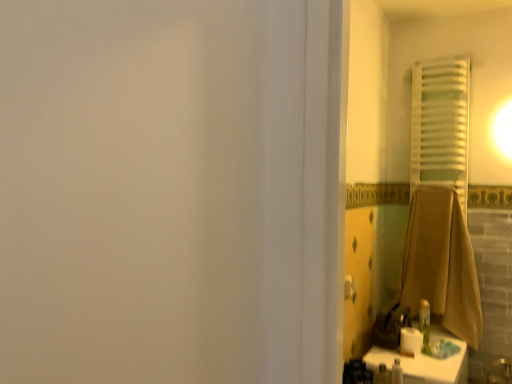
Question: From the image's perspective, is white matte toilet paper at lower right beneath brown cotton towel at right?

Choices:
 (A) no
 (B) yes

Answer: (B)

Question: From the image's perspective, is white matte toilet paper at lower right on brown cotton towel at right?

Choices:
 (A) yes
 (B) no

Answer: (B)

Question: Does white matte toilet paper at lower right have a lesser height compared to brown cotton towel at right?

Choices:
 (A) no
 (B) yes

Answer: (B)

Question: Does white matte toilet paper at lower right contain brown cotton towel at right?

Choices:
 (A) yes
 (B) no

Answer: (B)

Question: Is white matte toilet paper at lower right thinner than brown cotton towel at right?

Choices:
 (A) no
 (B) yes

Answer: (B)

Question: From a real-world perspective, relative to white glossy counter top at lower right, is brown cotton towel at right vertically above or below?

Choices:
 (A) above
 (B) below

Answer: (A)

Question: Do you think brown cotton towel at right is within white glossy counter top at lower right, or outside of it?

Choices:
 (A) inside
 (B) outside

Answer: (B)

Question: In terms of size, does brown cotton towel at right appear bigger or smaller than white glossy counter top at lower right?

Choices:
 (A) small
 (B) big

Answer: (A)

Question: From the image's perspective, is brown cotton towel at right above or below white glossy counter top at lower right?

Choices:
 (A) above
 (B) below

Answer: (A)

Question: In terms of size, does white fabric towel at right appear bigger or smaller than white matte toilet paper at lower right?

Choices:
 (A) big
 (B) small

Answer: (A)

Question: From a real-world perspective, is white fabric towel at right physically located above or below white matte toilet paper at lower right?

Choices:
 (A) above
 (B) below

Answer: (A)

Question: Would you say white fabric towel at right is inside or outside white matte toilet paper at lower right?

Choices:
 (A) outside
 (B) inside

Answer: (A)

Question: Is point (420, 107) closer or farther from the camera than point (411, 332)?

Choices:
 (A) farther
 (B) closer

Answer: (A)

Question: Is white fabric towel at right taller or shorter than brown cotton towel at right?

Choices:
 (A) short
 (B) tall

Answer: (B)

Question: Is white fabric towel at right to the left or to the right of brown cotton towel at right in the image?

Choices:
 (A) left
 (B) right

Answer: (B)